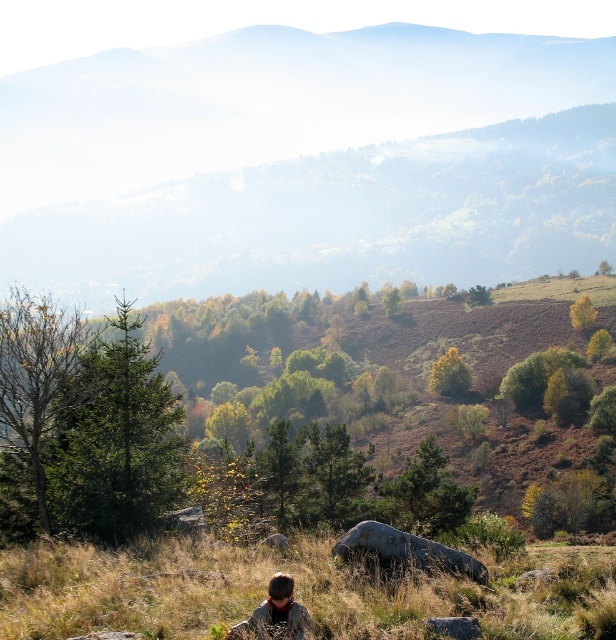
You are standing at the edge of the grassy area and want to place a small flag on the ground. You have two options to choose from the image. Which object is located lower down between the green grass at lower center and the gray rough rock at center?

The green grass at lower center is located lower down than the gray rough rock at center.

You are a hiker who wants to find the best spot to set up a tent. You have two options in the image provided. The first option is the green leafy hillside at center, and the second option is the green grass at lower center. Which area would you choose and why?

The green leafy hillside at center is bigger than the green grass at lower center, so the green leafy hillside at center would provide a more spacious area for setting up a tent compared to the smaller green grass at lower center.

You are planning to place a small garden shed in the scene. The shed requires a flat area of at least 100 meters between the green leafy hillside at center and the green grass at lower center. Is there enough space for the shed?

The green leafy hillside at center and the green grass at lower center are 103.43 meters apart, which is more than the required 100 meters. Therefore, there is enough space to place the shed between them.